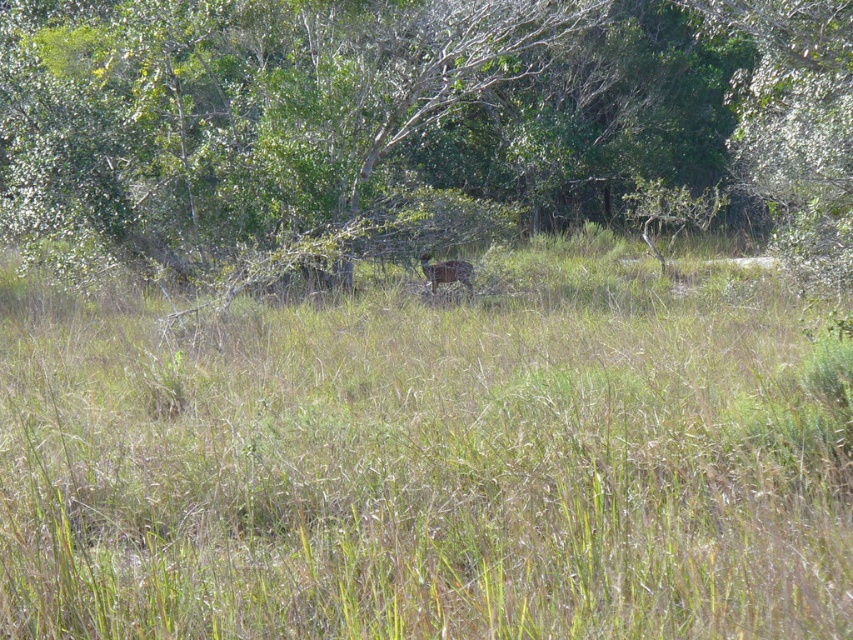
Question: Which object is farther from the camera taking this photo?

Choices:
 (A) green leafy tree at center
 (B) green grassy at center
 (C) brown fur deer at center

Answer: (C)

Question: Which point is farther to the camera?

Choices:
 (A) (165, 97)
 (B) (433, 317)
 (C) (445, 269)

Answer: (A)

Question: Can you confirm if green leafy tree at center is wider than brown fur deer at center?

Choices:
 (A) no
 (B) yes

Answer: (B)

Question: Which of these objects is positioned closest to the green leafy tree at center?

Choices:
 (A) brown fur deer at center
 (B) green grassy at center

Answer: (B)

Question: Does green grassy at center appear over brown fur deer at center?

Choices:
 (A) no
 (B) yes

Answer: (A)

Question: Observing the image, what is the correct spatial positioning of green grassy at center in reference to green leafy tree at center?

Choices:
 (A) above
 (B) below

Answer: (B)